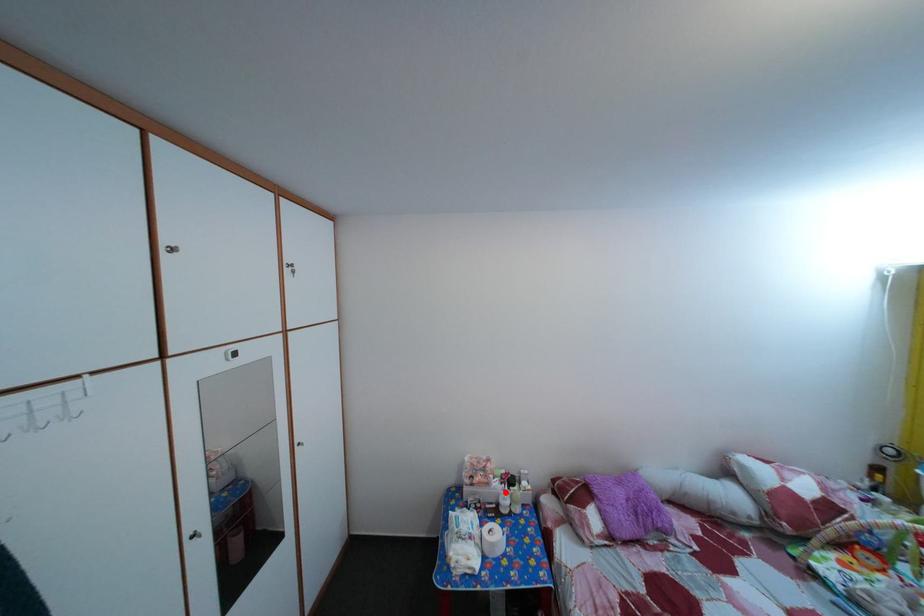
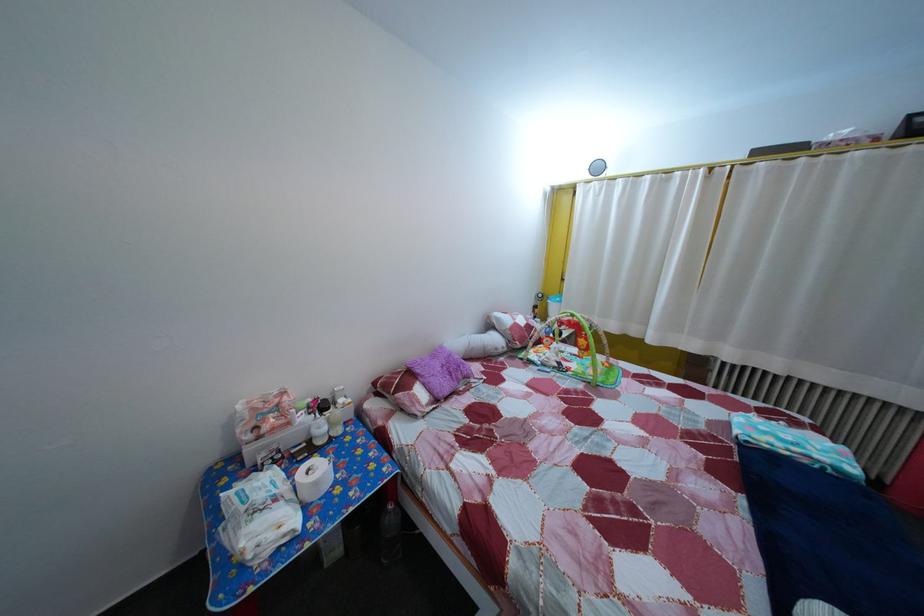
Where in the second image is the point corresponding to the highlighted location from the first image?

(311, 427)